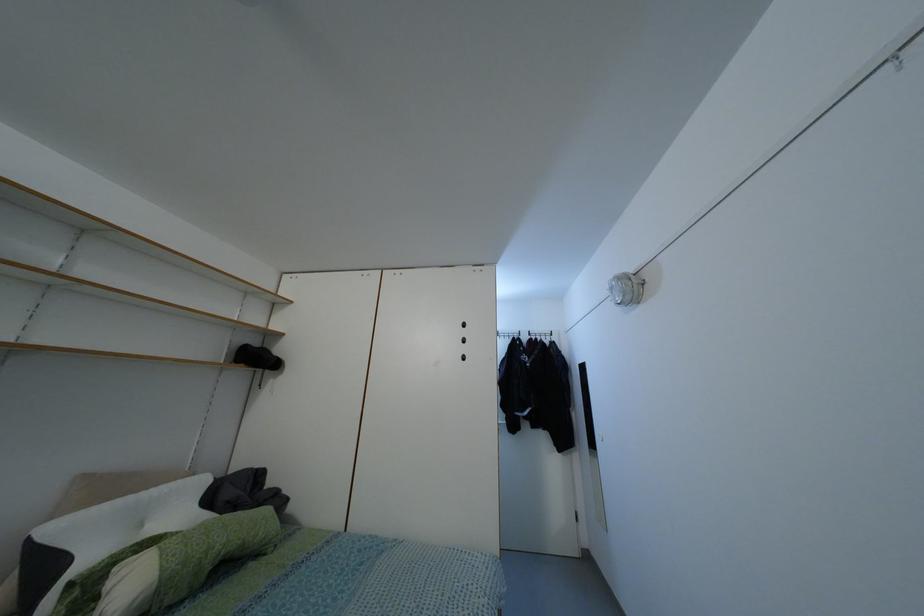
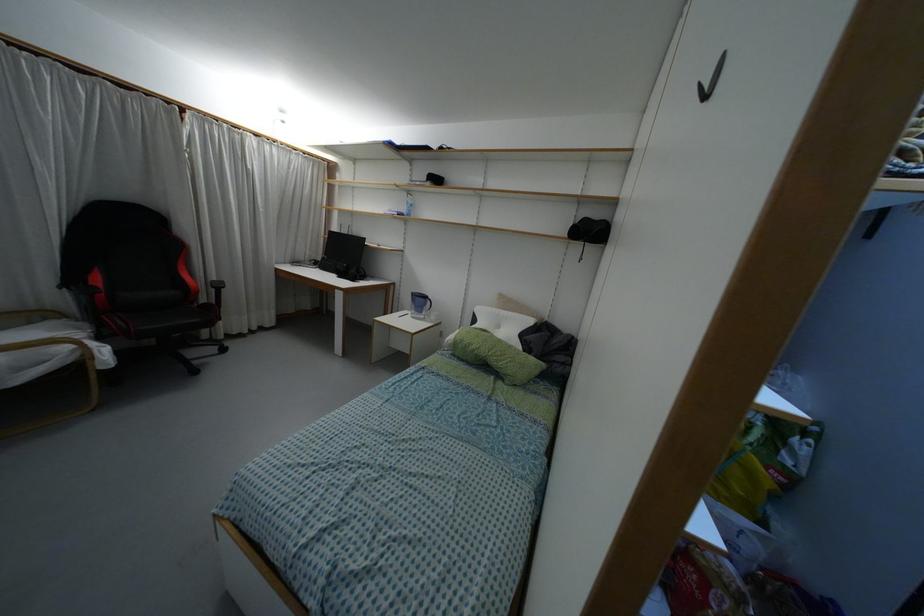
In the second image, find the point that corresponds to point (129, 498) in the first image.

(496, 310)